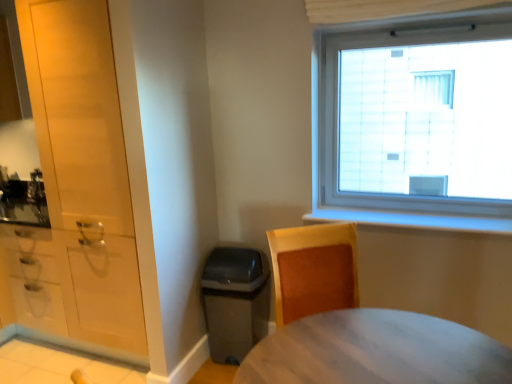
Question: From the image's perspective, is wooden desk at lower right located beneath matte white cabinet at left, acting as the 1th cabinetry starting from the right?

Choices:
 (A) no
 (B) yes

Answer: (B)

Question: Is wooden desk at lower right aimed at matte white cabinet at left, the 2th cabinetry from the left?

Choices:
 (A) yes
 (B) no

Answer: (B)

Question: Is wooden desk at lower right taller than matte white cabinet at left, the 2th cabinetry from the left?

Choices:
 (A) yes
 (B) no

Answer: (B)

Question: Does wooden desk at lower right appear on the left side of matte white cabinet at left, the 2th cabinetry from the left?

Choices:
 (A) yes
 (B) no

Answer: (B)

Question: Is wooden desk at lower right thinner than matte white cabinet at left, acting as the 1th cabinetry starting from the right?

Choices:
 (A) yes
 (B) no

Answer: (B)

Question: Is matte white cabinet at left, acting as the 1th cabinetry starting from the right, inside the boundaries of wooden desk at lower right, or outside?

Choices:
 (A) outside
 (B) inside

Answer: (A)

Question: Looking at their shapes, would you say matte white cabinet at left, acting as the 1th cabinetry starting from the right, is wider or thinner than wooden desk at lower right?

Choices:
 (A) thin
 (B) wide

Answer: (A)

Question: Considering the positions of matte white cabinet at left, acting as the 1th cabinetry starting from the right, and wooden desk at lower right in the image, is matte white cabinet at left, acting as the 1th cabinetry starting from the right, taller or shorter than wooden desk at lower right?

Choices:
 (A) short
 (B) tall

Answer: (B)

Question: From the image's perspective, is matte white cabinet at left, the 2th cabinetry from the left, above or below wooden desk at lower right?

Choices:
 (A) below
 (B) above

Answer: (B)

Question: From the image's perspective, relative to matte white cabinet at left, the 2th cabinetry from the left, is matte white cabinets at left, acting as the 1th cabinetry starting from the left, above or below?

Choices:
 (A) above
 (B) below

Answer: (B)

Question: Is matte white cabinets at left, acting as the 1th cabinetry starting from the left, bigger or smaller than matte white cabinet at left, the 2th cabinetry from the left?

Choices:
 (A) big
 (B) small

Answer: (B)

Question: In terms of height, does matte white cabinets at left, which ranks as the 2th cabinetry in right-to-left order, look taller or shorter compared to matte white cabinet at left, the 2th cabinetry from the left?

Choices:
 (A) short
 (B) tall

Answer: (A)

Question: Choose the correct answer: Is matte white cabinets at left, which ranks as the 2th cabinetry in right-to-left order, inside matte white cabinet at left, acting as the 1th cabinetry starting from the right, or outside it?

Choices:
 (A) outside
 (B) inside

Answer: (A)

Question: From a real-world perspective, is matte white cabinet at left, the 2th cabinetry from the left, above or below matte white cabinets at left, which ranks as the 2th cabinetry in right-to-left order?

Choices:
 (A) below
 (B) above

Answer: (B)

Question: Is matte white cabinet at left, acting as the 1th cabinetry starting from the right, in front of or behind matte white cabinets at left, which ranks as the 2th cabinetry in right-to-left order, in the image?

Choices:
 (A) behind
 (B) front

Answer: (B)